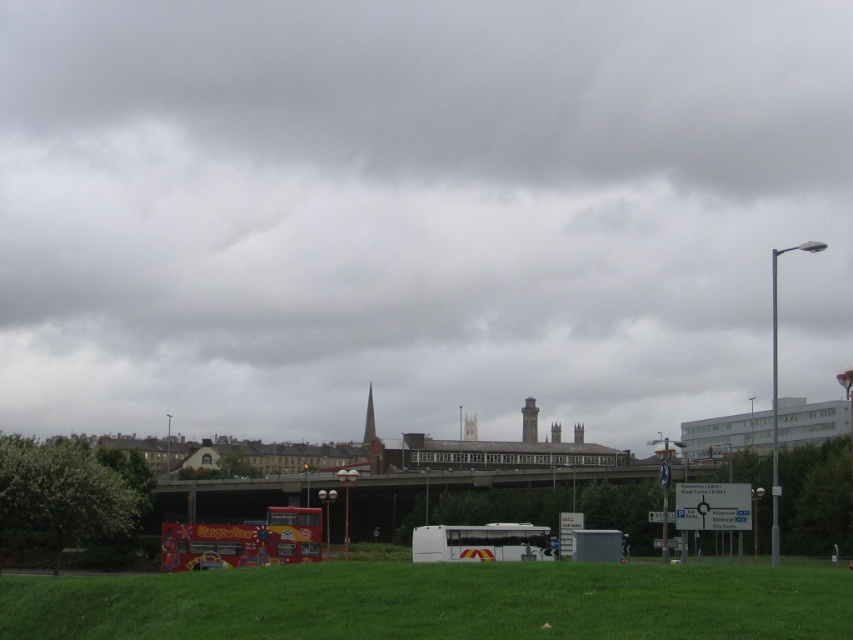
You are a pedestrian standing on the green grass at lower center. You want to cross the street to reach a nearby store. The white matte bus at center is blocking your path. Can you walk around the bus on either side?

The green grass at lower center is smaller than the white matte bus at center, so it might be difficult to walk around the bus on either side due to limited space.